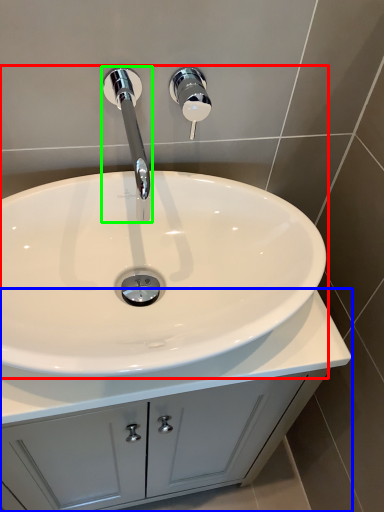
Question: Which object is positioned farthest from sink (highlighted by a red box)? Select from bathroom cabinet (highlighted by a blue box) and tap (highlighted by a green box).

Choices:
 (A) bathroom cabinet
 (B) tap

Answer: (A)